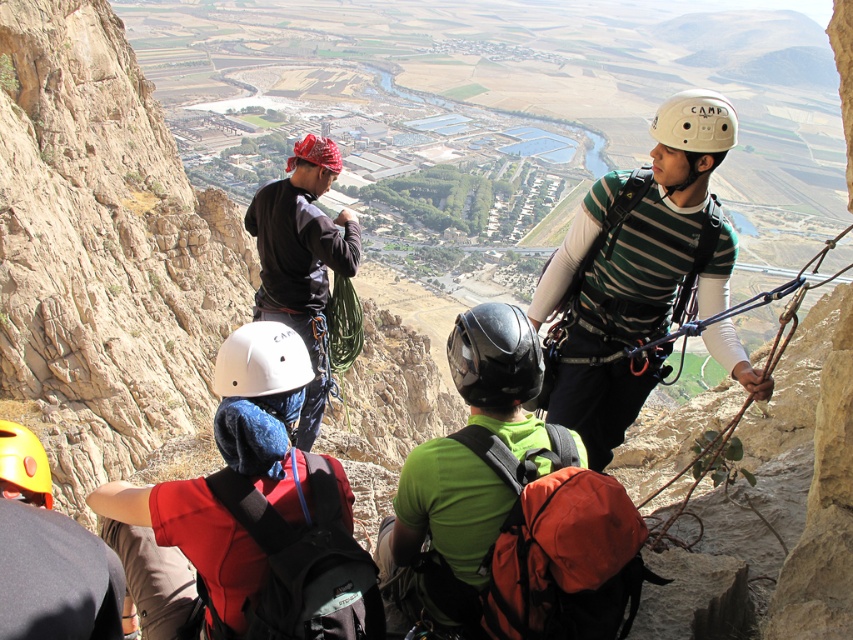
Between black matte helmet at center and yellow matte helmet at lower left, which one appears on the right side from the viewer's perspective?

black matte helmet at center is more to the right.

Can you confirm if black matte helmet at center is positioned to the left of yellow matte helmet at lower left?

Incorrect, black matte helmet at center is not on the left side of yellow matte helmet at lower left.

Is point (523, 385) closer to viewer compared to point (19, 477)?

That is False.

You are a GUI agent. You are given a task and a screenshot of the screen. Output one action in this format:
    pyautogui.click(x=<x>, y=<y>)
    Task: Click on the black matte helmet at center
    The image size is (853, 640).
    Given the screenshot: What is the action you would take?
    pyautogui.click(x=494, y=356)

Does green striped shirt at center have a larger size compared to white matte helmet at upper center?

Actually, green striped shirt at center might be smaller than white matte helmet at upper center.

Identify the location of green striped shirt at center. This screenshot has width=853, height=640. (637, 269).

At what (x,y) coordinates should I click in order to perform the action: click on green striped shirt at center. Please return your answer as a coordinate pair (x, y). The height and width of the screenshot is (640, 853). Looking at the image, I should click on (637, 269).

This screenshot has height=640, width=853. Find the location of `green striped shirt at center`. green striped shirt at center is located at coordinates (637, 269).

Based on the photo, does green striped shirt at center have a smaller size compared to white matte helmet at center?

No.

Does green striped shirt at center come behind white matte helmet at center?

No, green striped shirt at center is in front of white matte helmet at center.

Is point (665, 113) more distant than point (238, 378)?

Yes, it is behind point (238, 378).

You are a GUI agent. You are given a task and a screenshot of the screen. Output one action in this format:
    pyautogui.click(x=<x>, y=<y>)
    Task: Click on the green striped shirt at center
    The width and height of the screenshot is (853, 640).
    Given the screenshot: What is the action you would take?
    pyautogui.click(x=637, y=269)